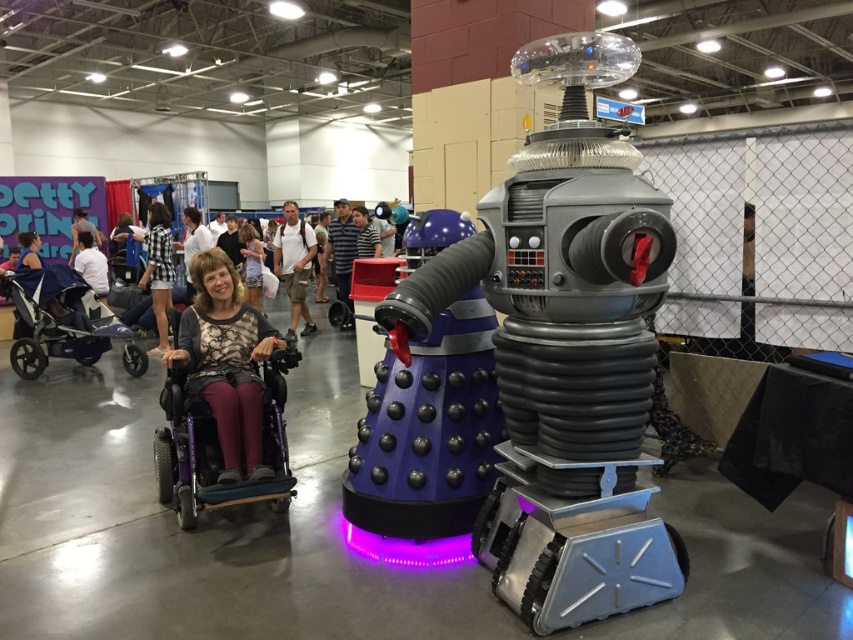
Question: Which point is farther to the camera?

Choices:
 (A) matte white shirt at upper left
 (B) checkered fabric shirt at upper left
 (C) purple matte wheelchair at left
 (D) purple matte wheelchair at lower left

Answer: (A)

Question: Based on their relative distances, which object is farther from the light brown fabric shirt at center?

Choices:
 (A) matte black wheelchair at center
 (B) matte purple wheelchair at left

Answer: (B)

Question: Does purple matte wheelchair at lower left have a larger size compared to matte black wheelchair at center?

Choices:
 (A) no
 (B) yes

Answer: (A)

Question: Observing the image, what is the correct spatial positioning of checkered fabric shirt at upper left in reference to matte white shirt at upper left?

Choices:
 (A) below
 (B) above

Answer: (A)

Question: Does purple matte wheelchair at lower left appear over light brown fabric shirt at center?

Choices:
 (A) no
 (B) yes

Answer: (A)

Question: Which point is farther to the camera?

Choices:
 (A) (529, 179)
 (B) (160, 205)

Answer: (B)